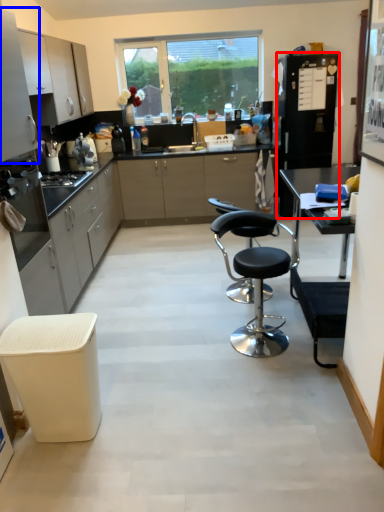
Question: Among these objects, which one is farthest to the camera, appliance (highlighted by a red box) or cabinetry (highlighted by a blue box)?

Choices:
 (A) appliance
 (B) cabinetry

Answer: (A)